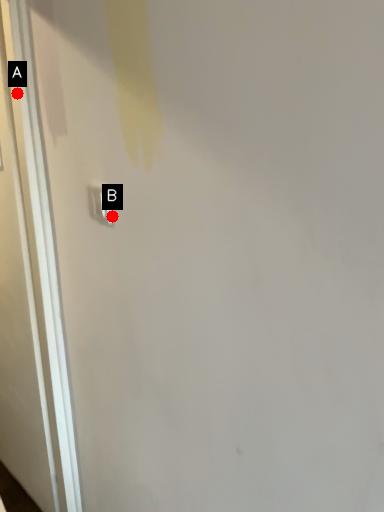
Question: Two points are circled on the image, labeled by A and B beside each circle. Which point is closer to the camera?

Choices:
 (A) A is closer
 (B) B is closer

Answer: (B)